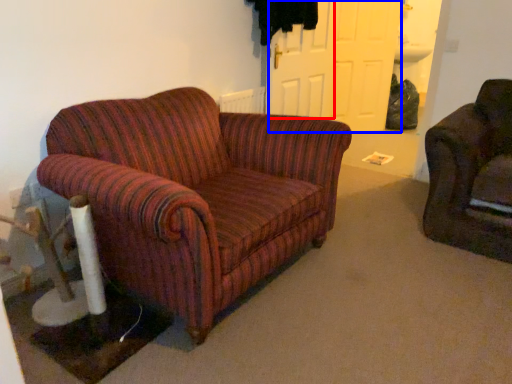
Question: Which object appears closest to the camera in this image, door (highlighted by a red box) or door (highlighted by a blue box)?

Choices:
 (A) door
 (B) door

Answer: (A)